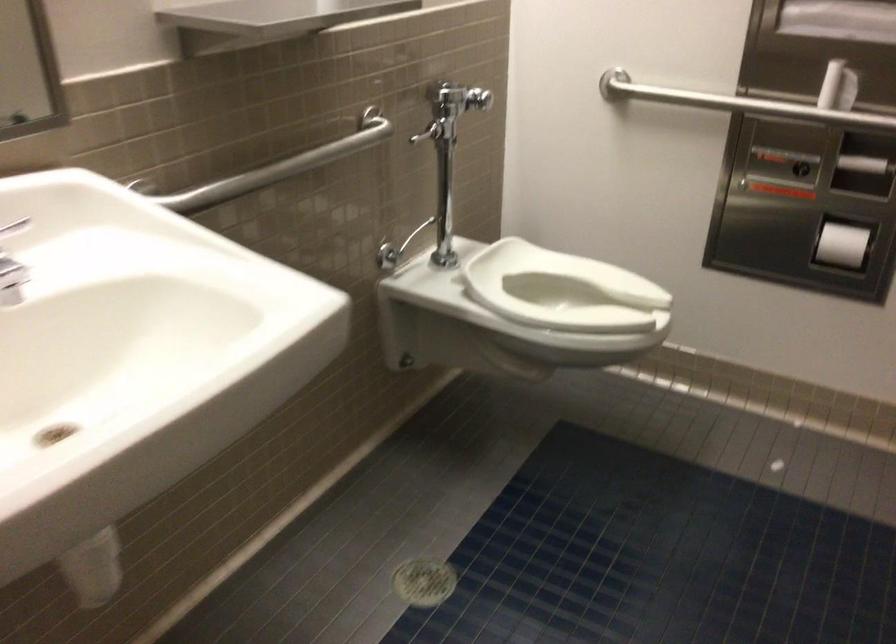
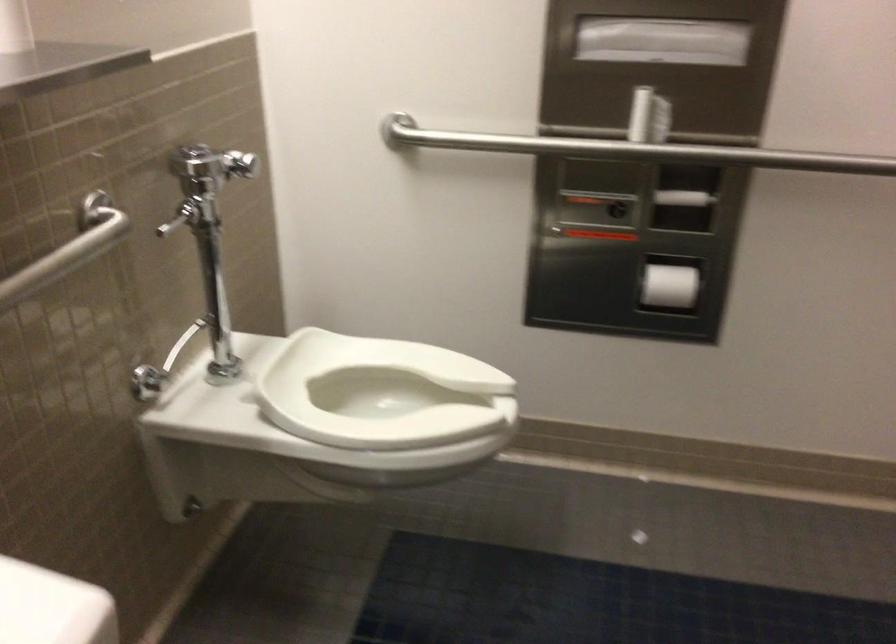
In the second image, find the point that corresponds to point 339,140 in the first image.

(67, 250)